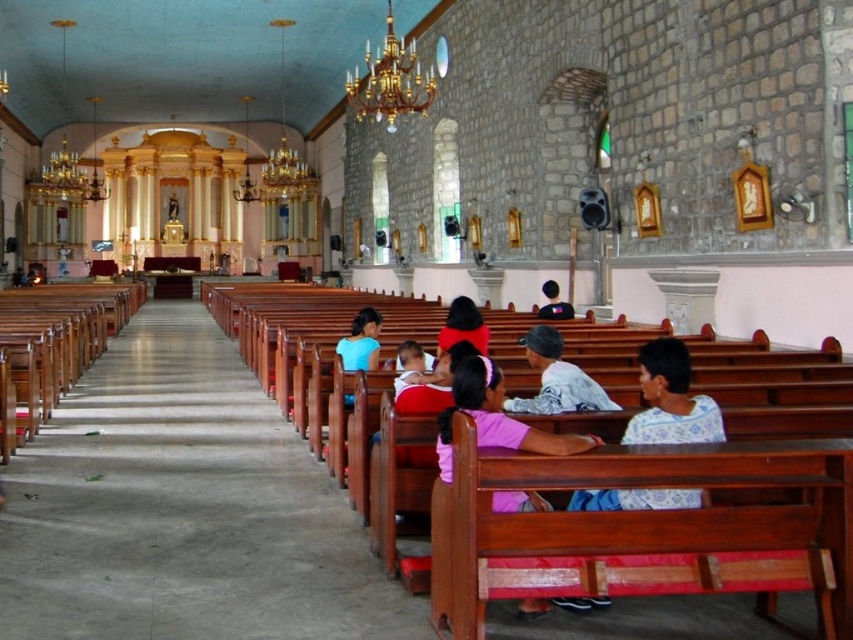
Is point (364, 324) closer to viewer compared to point (442, 340)?

No, (364, 324) is further to viewer.

Between point (358, 312) and point (473, 332), which one is positioned in front?

Point (473, 332)

Image resolution: width=853 pixels, height=640 pixels. What are the coordinates of `matte blue shirt at center` in the screenshot? It's located at (360, 342).

Who is positioned more to the right, matte blue shirt at center or black fabric shirt at center?

black fabric shirt at center is more to the right.

This screenshot has width=853, height=640. What do you see at coordinates (360, 342) in the screenshot?
I see `matte blue shirt at center` at bounding box center [360, 342].

Identify the location of matte blue shirt at center. This screenshot has width=853, height=640. (360, 342).

Is pink fabric at lower center to the right of white cotton shirt at center from the viewer's perspective?

Incorrect, pink fabric at lower center is not on the right side of white cotton shirt at center.

Is point (567, 438) farther from camera compared to point (527, 358)?

No, (567, 438) is closer to viewer.

Is point (450, 416) positioned after point (543, 388)?

No.

The image size is (853, 640). I want to click on pink fabric at lower center, so [x=495, y=419].